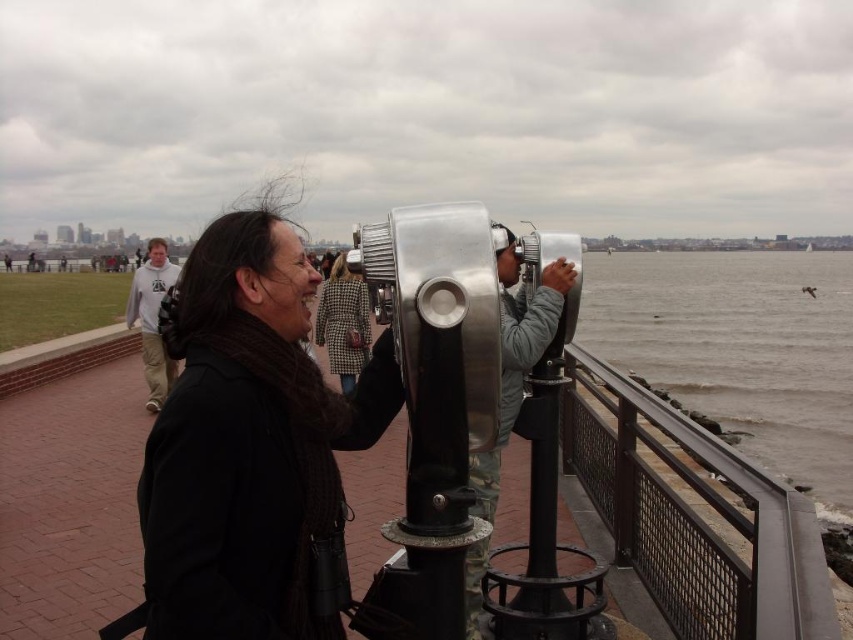
You are standing at the waterfront promenade and see two people at the center using the binoculars. Which person is wearing the black wool scarf at center located to the right of the light gray hoodie at center?

The black wool scarf at center is to the right of the light gray hoodie at center, so the person wearing the black wool scarf at center is positioned to the right of the one in the light gray hoodie at center.

You are a tourist standing at the waterfront promenade. You want to take a photo of the light gray hoodie at center while avoiding the metallic gray binoculars at center in the frame. Which direction should you move to ensure the binoculars are out of the shot?

The metallic gray binoculars at center are on the right side of the light gray hoodie at center. To avoid the binoculars in your photo, move to the left side of the light gray hoodie at center so the binoculars are no longer in the frame.

You are a photographer trying to capture a closeup of the waterfront view. You notice the black wool scarf at center and the light gray hoodie at center in your shot. Which object should you move to get a clearer view?

The black wool scarf at center is bigger than the light gray hoodie at center, so moving the black wool scarf at center would provide a clearer view as it is larger and likely blocking more of the scene.